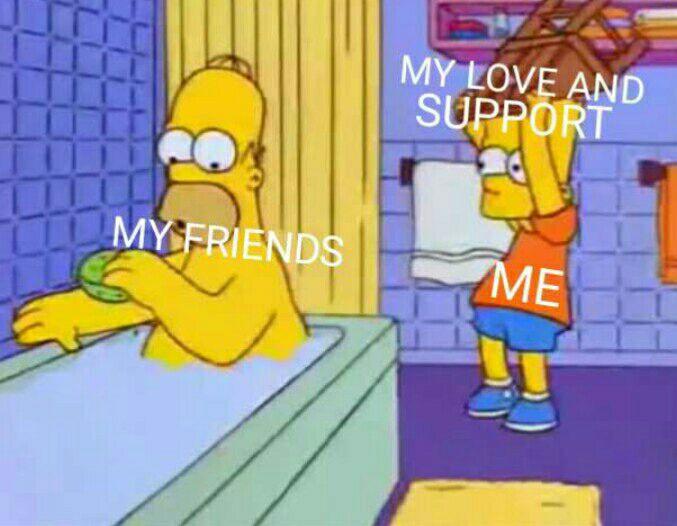
Where is `shelf`? The image size is (677, 526). shelf is located at coordinates (471, 37).